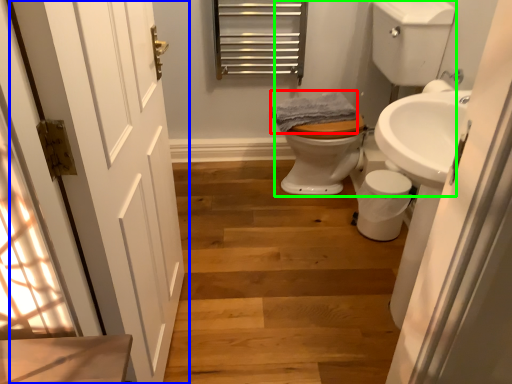
Question: Which object is positioned closest to bath towel (highlighted by a red box)? Select from door (highlighted by a blue box) and landing (highlighted by a green box).

Choices:
 (A) door
 (B) landing

Answer: (B)